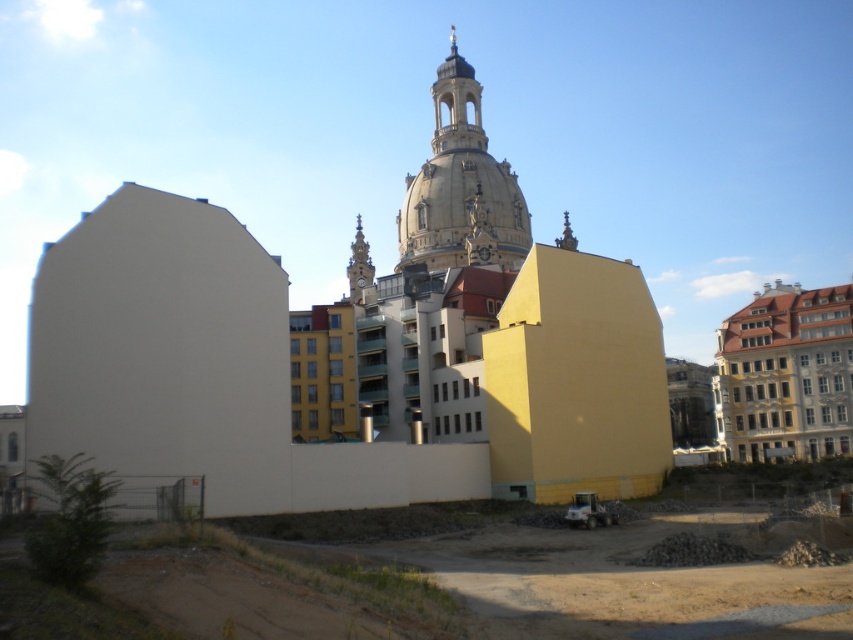
You are a construction worker standing at the edge of the construction site. You need to move a heavy tool from the smooth concrete ground at lower center to the beige stone dome at center. Which object will you step on first?

You will step on the smooth concrete ground at lower center first because it is closer to you than the beige stone dome at center.

You are a construction worker who needs to place a new temporary barrier between the smooth stone church at center and the beige stone dome at center. Based on their positions, which one should the barrier be closer to?

The smooth stone church at center is below the beige stone dome at center, so the barrier should be placed closer to the smooth stone church at center to ensure it is between them.

In the scene shown: Based on the scene description, what type of ground surface can be found at the coordinates point [473,572]?

The ground at point [473,572] is smooth concrete ground at lower center.